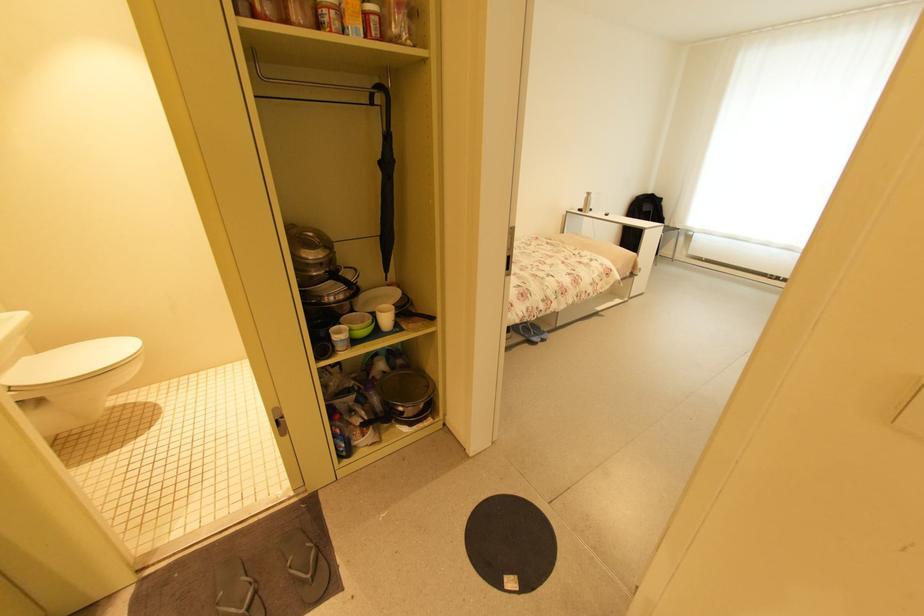
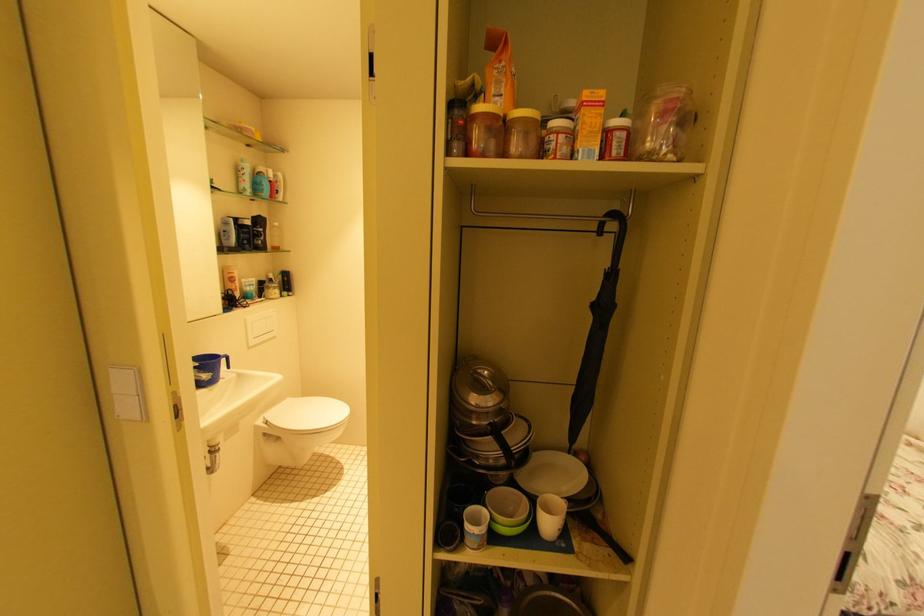
Question: The images are taken continuously from a first-person perspective. In which direction is your viewpoint rotating?

Choices:
 (A) Left
 (B) Right
 (C) Up
 (D) Down

Answer: (A)